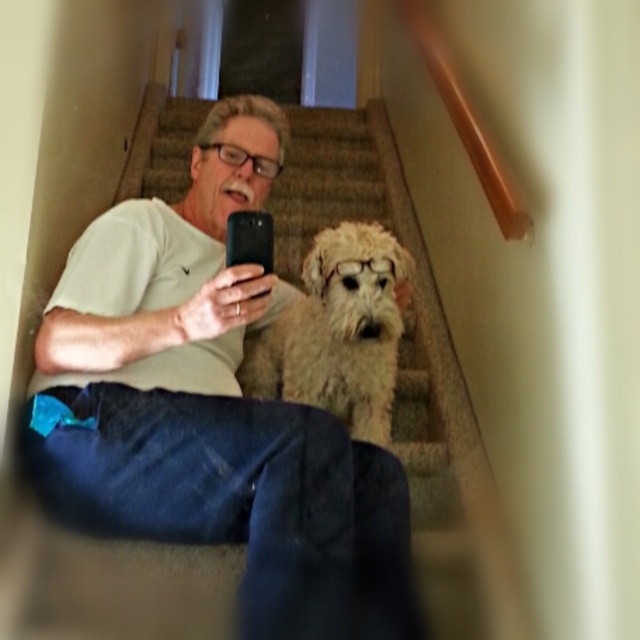
Locate an element on the screen. Image resolution: width=640 pixels, height=640 pixels. white cotton shirt at center is located at coordinates (211, 410).

This screenshot has width=640, height=640. I want to click on white cotton shirt at center, so click(x=211, y=410).